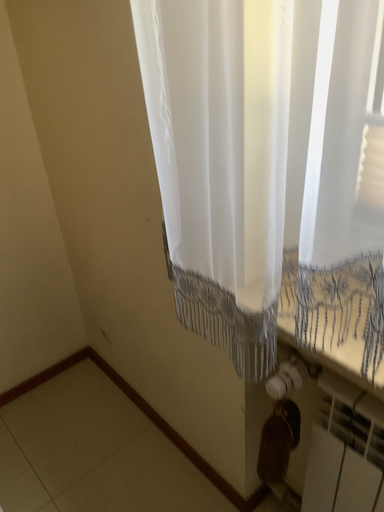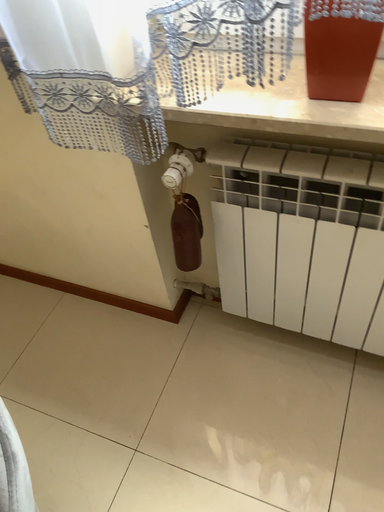
Question: How did the camera likely rotate when shooting the video?

Choices:
 (A) rotated left
 (B) rotated right

Answer: (B)